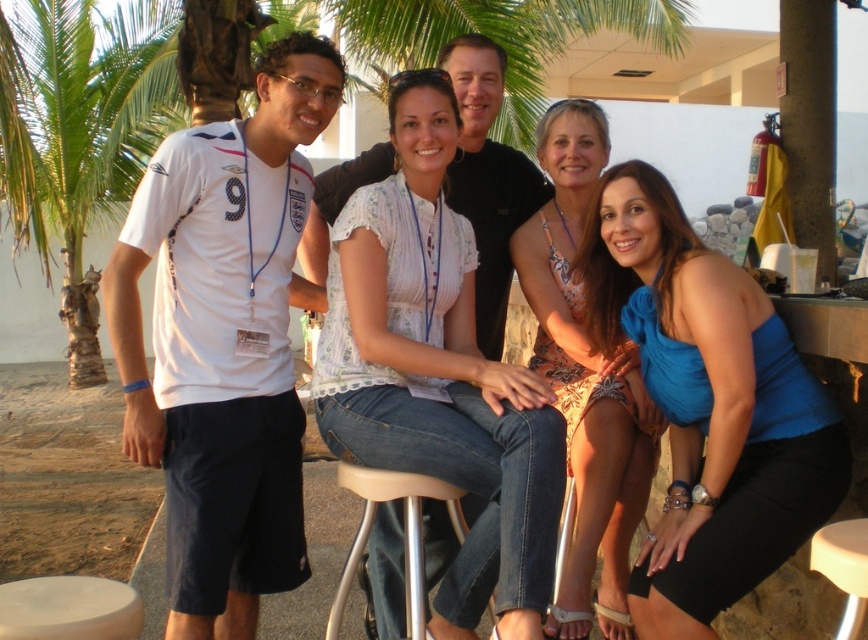
Looking at this image, you are a photographer trying to capture a closeup of the white lace blouse at center. The camera you are using has a limited focus range. Can you determine if the point you are aiming at, point (438, 372), is where the white lace blouse at center is located?

Yes, the white lace blouse at center is located at point (438, 372), so aiming the camera there will capture it.

You are a photographer standing at the center of the scene. You need to adjust the lighting so that both the printed fabric dress at center and the beige plastic bar stool at lower right are evenly illuminated. Given their distance apart, is this adjustment feasible without moving either object?

The printed fabric dress at center is 3.63 feet away from the beige plastic bar stool at lower right. This distance allows the photographer to adjust the lighting to evenly illuminate both objects without needing to move them.